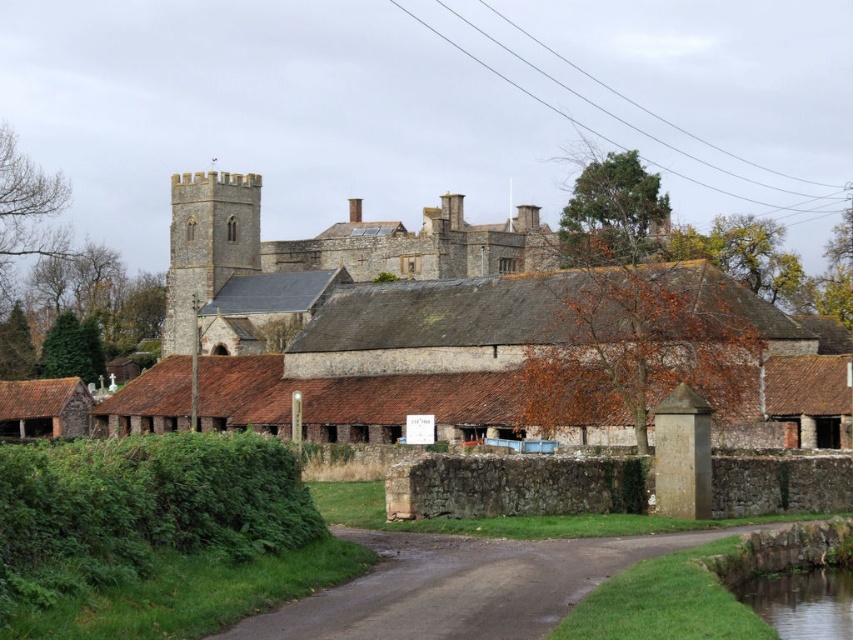
Measure the distance between brown clay barns at center and camera.

brown clay barns at center and camera are 59.58 meters apart.

Is brown clay barns at center positioned at the back of green grassy river at lower right?

Yes, it is behind green grassy river at lower right.

Which is behind, point (834, 413) or point (808, 576)?

Point (834, 413)

At what (x,y) coordinates should I click in order to perform the action: click on brown clay barns at center. Please return your answer as a coordinate pair (x, y). The width and height of the screenshot is (853, 640). Looking at the image, I should click on (436, 333).

Does brown clay barns at center have a lesser width compared to damp asphalt road at center?

No, brown clay barns at center is not thinner than damp asphalt road at center.

Is point (171, 214) closer to camera compared to point (438, 556)?

No, (171, 214) is further to viewer.

Locate an element on the screen. brown clay barns at center is located at coordinates (436, 333).

Is brown clay barns at center wider than brown stone castle at center?

Yes, brown clay barns at center is wider than brown stone castle at center.

Based on the photo, does brown clay barns at center come behind brown stone castle at center?

No, it is not.

Locate an element on the screen. brown clay barns at center is located at coordinates coord(436,333).

This screenshot has width=853, height=640. I want to click on brown clay barns at center, so click(436, 333).